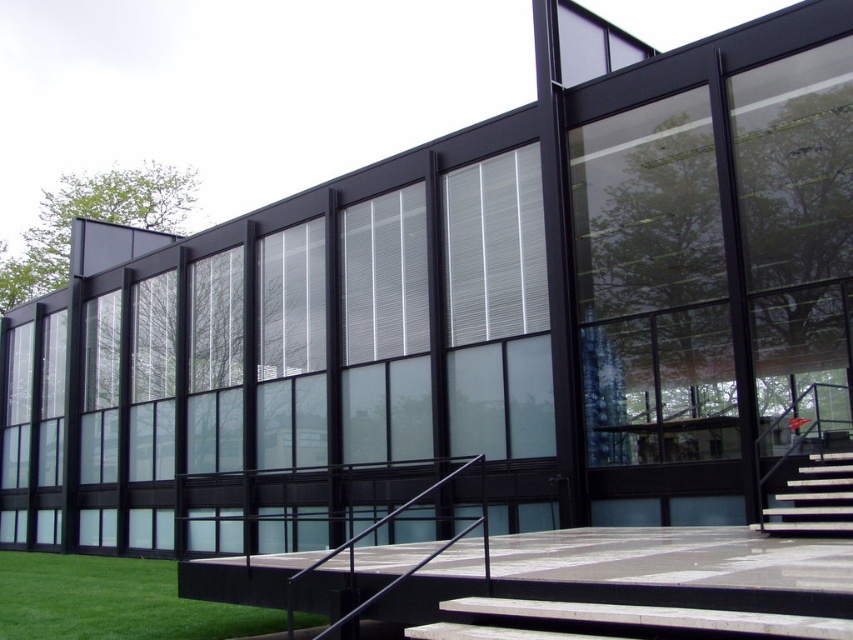
Question: Is green grass at lower left to the right of white glossy stair at lower right from the viewer's perspective?

Choices:
 (A) no
 (B) yes

Answer: (A)

Question: Which point is farther from the camera taking this photo?

Choices:
 (A) (250, 634)
 (B) (770, 520)

Answer: (B)

Question: Among these points, which one is farthest from the camera?

Choices:
 (A) (798, 474)
 (B) (113, 572)
 (C) (444, 484)

Answer: (B)

Question: Does green grass at lower left have a smaller size compared to black metal/rail at center?

Choices:
 (A) no
 (B) yes

Answer: (A)

Question: Observing the image, what is the correct spatial positioning of green grass at lower left in reference to black metal/rail at center?

Choices:
 (A) above
 (B) below

Answer: (B)

Question: Which point appears farthest from the camera in this image?

Choices:
 (A) (817, 474)
 (B) (471, 461)
 (C) (61, 637)

Answer: (B)